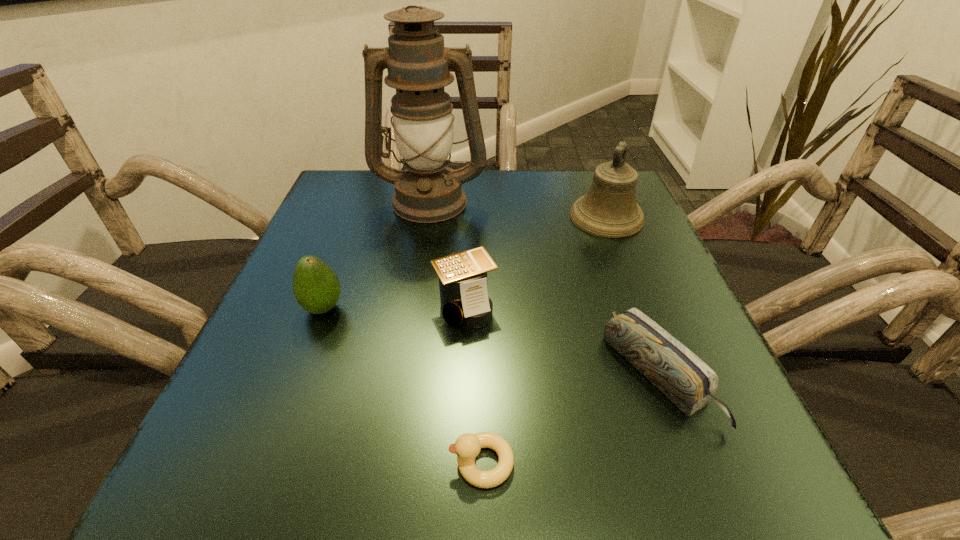
Image resolution: width=960 pixels, height=540 pixels. What are the coordinates of `vacant area situated 0.250m on the left of the pencil box` in the screenshot? It's located at (443, 376).

In order to click on free location located at the beak of the duckling in this screenshot , I will do `click(299, 463)`.

Where is `free region located at the beak of the duckling`? The width and height of the screenshot is (960, 540). free region located at the beak of the duckling is located at coordinates (211, 463).

Find the location of a particular element. vacant region located at the beak of the duckling is located at coordinates (378, 463).

Where is `oil lamp that is at the far edge`? The height and width of the screenshot is (540, 960). oil lamp that is at the far edge is located at coordinates point(418,64).

This screenshot has width=960, height=540. I want to click on bell present at the far edge, so click(x=609, y=209).

This screenshot has height=540, width=960. I want to click on object that is at the near edge, so click(x=467, y=447).

At what (x,y) coordinates should I click in order to perform the action: click on oil lamp at the left edge. Please return your answer as a coordinate pair (x, y). Image resolution: width=960 pixels, height=540 pixels. Looking at the image, I should click on [418, 64].

Identify the location of avocado that is positioned at the left edge. (316, 287).

The image size is (960, 540). I want to click on bell that is at the right edge, so click(609, 209).